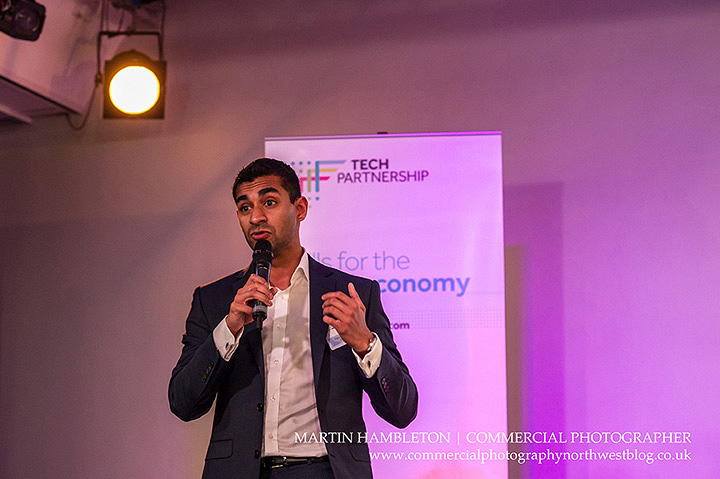
The height and width of the screenshot is (479, 720). In order to click on white board with pink reflection on it in this screenshot , I will do `click(451, 243)`.